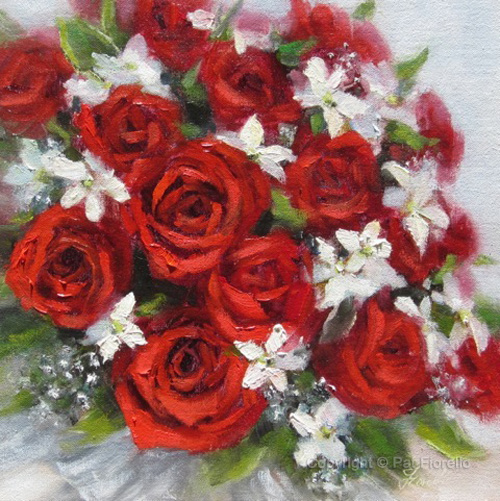
Where is `floor`? Image resolution: width=500 pixels, height=501 pixels. floor is located at coordinates (41, 486), (463, 481).